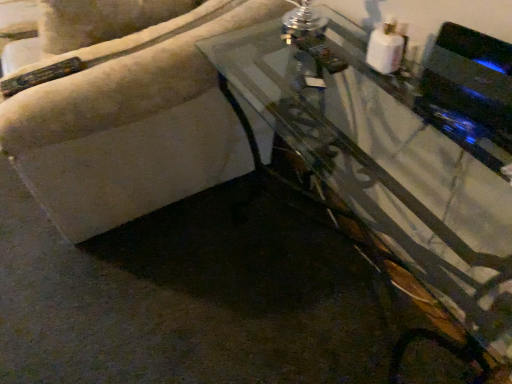
I want to click on free space in front of black glossy speaker at upper right, so click(x=460, y=174).